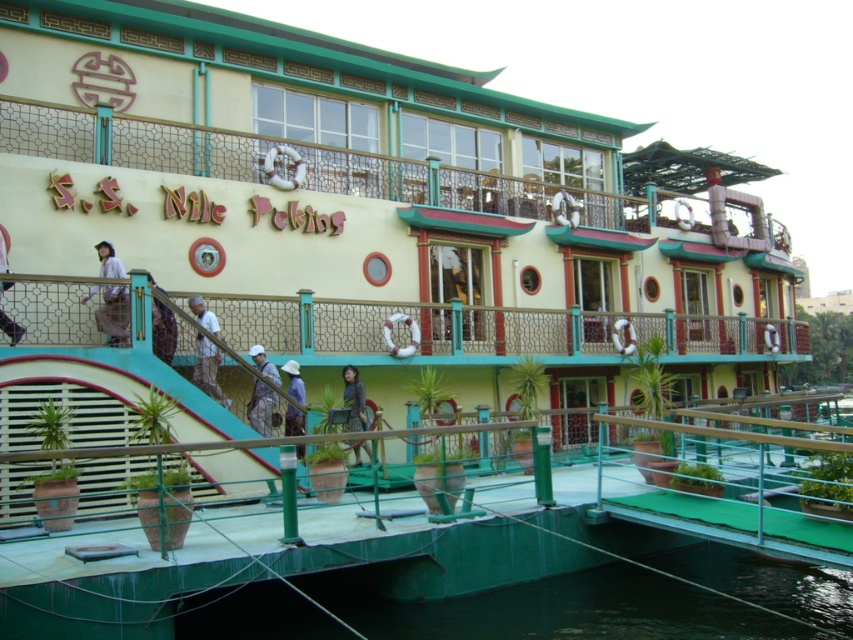
Question: Can you confirm if white fabric shirt at lower left is positioned below blue fabric hat at center?

Choices:
 (A) no
 (B) yes

Answer: (A)

Question: Can you confirm if light brown fabric pants at center is positioned to the left of white fabric shirt at lower left?

Choices:
 (A) no
 (B) yes

Answer: (B)

Question: Which point is farther to the camera?

Choices:
 (A) matte black jacket at center
 (B) matte white helmet at lower left
 (C) light brown wooden stairs at center
 (D) light brown fabric pants at center

Answer: (A)

Question: Which of the following is the closest to the observer?

Choices:
 (A) white fabric shirt at lower left
 (B) matte black jacket at center

Answer: (A)

Question: Can you confirm if blue fabric hat at center is positioned to the left of matte white helmet at lower left?

Choices:
 (A) no
 (B) yes

Answer: (A)

Question: Estimate the real-world distances between objects in this image. Which object is closer to the white fabric shirt at lower left?

Choices:
 (A) light brown fabric pants at center
 (B) light brown wooden stairs at center
 (C) matte black jacket at center
 (D) blue fabric hat at center

Answer: (B)